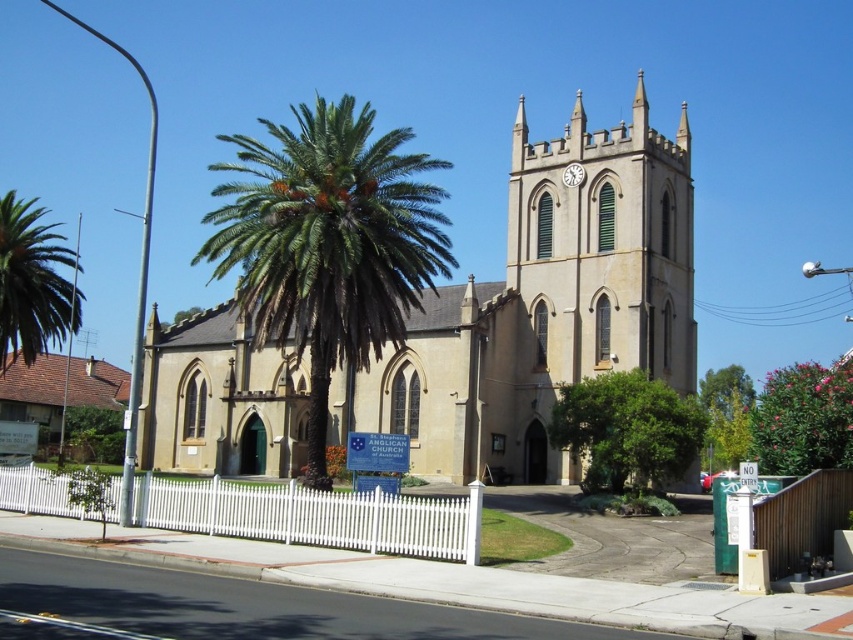
Question: Which of these objects is positioned farthest from the green leafy palm tree at center?

Choices:
 (A) beige stone church at center
 (B) green leafy tree at center
 (C) green leafy palm tree at lower left
 (D) green leafy palm tree at left

Answer: (C)

Question: Does green leafy palm tree at center lie in front of green leafy palm tree at lower left?

Choices:
 (A) no
 (B) yes

Answer: (B)

Question: Which object is positioned farthest from the green leafy palm tree at center?

Choices:
 (A) green leafy palm tree at left
 (B) beige stone church at center
 (C) green leafy tree at center
 (D) green leafy palm tree at lower left

Answer: (D)

Question: Where is green leafy palm tree at center located in relation to green leafy tree at center in the image?

Choices:
 (A) above
 (B) below

Answer: (A)

Question: Does beige stone church at center have a lesser width compared to pink glossy tree at right?

Choices:
 (A) no
 (B) yes

Answer: (A)

Question: Estimate the real-world distances between objects in this image. Which object is closer to the green leafy tree at center?

Choices:
 (A) beige stone church at center
 (B) green leafy palm tree at lower left

Answer: (A)